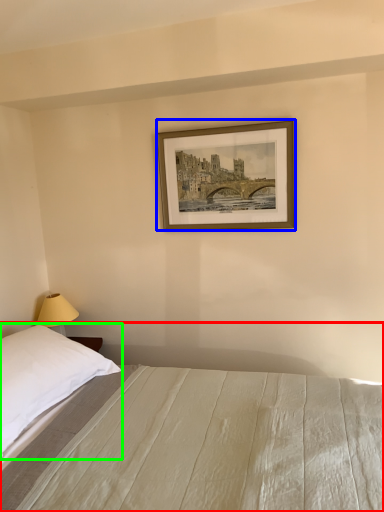
Question: Based on their relative distances, which object is nearer to bed (highlighted by a red box)? Choose from picture frame (highlighted by a blue box) and pillow (highlighted by a green box).

Choices:
 (A) picture frame
 (B) pillow

Answer: (B)